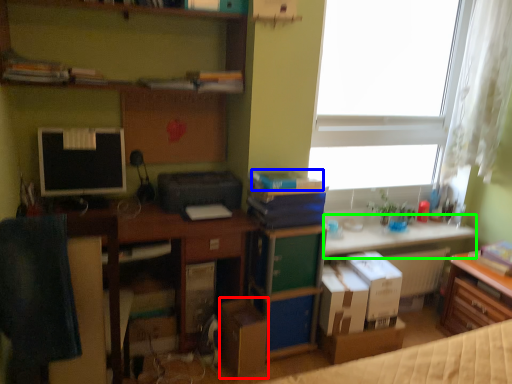
Question: Which object is the closest to the cardboard box (highlighted by a red box)? Choose among these: book (highlighted by a blue box) or table (highlighted by a green box).

Choices:
 (A) book
 (B) table

Answer: (A)